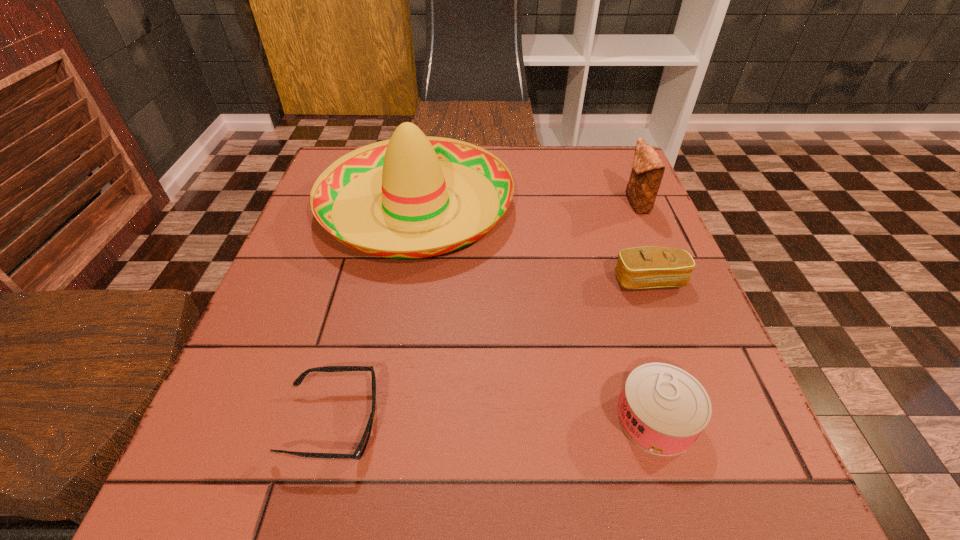
What are the coordinates of `free space located 0.310m on the zipper side of the nearer clutch bag` in the screenshot? It's located at (718, 460).

Find the location of `vacant region located on the right of the can`. vacant region located on the right of the can is located at coordinates (734, 419).

Where is `free space located on the front-facing side of the sunglasses`? The image size is (960, 540). free space located on the front-facing side of the sunglasses is located at coordinates (468, 423).

Where is `sombrero that is at the far edge`? The width and height of the screenshot is (960, 540). sombrero that is at the far edge is located at coordinates (414, 173).

Where is `clutch bag at the far edge`? The width and height of the screenshot is (960, 540). clutch bag at the far edge is located at coordinates (647, 172).

Where is `can present at the near edge`? can present at the near edge is located at coordinates (663, 409).

Find the location of a particular element. The height and width of the screenshot is (540, 960). sunglasses present at the near edge is located at coordinates (359, 452).

Locate an element on the screen. sombrero positioned at the left edge is located at coordinates (414, 173).

Locate an element on the screen. The image size is (960, 540). sunglasses at the left edge is located at coordinates (359, 452).

Identify the location of can that is at the right edge. (663, 409).